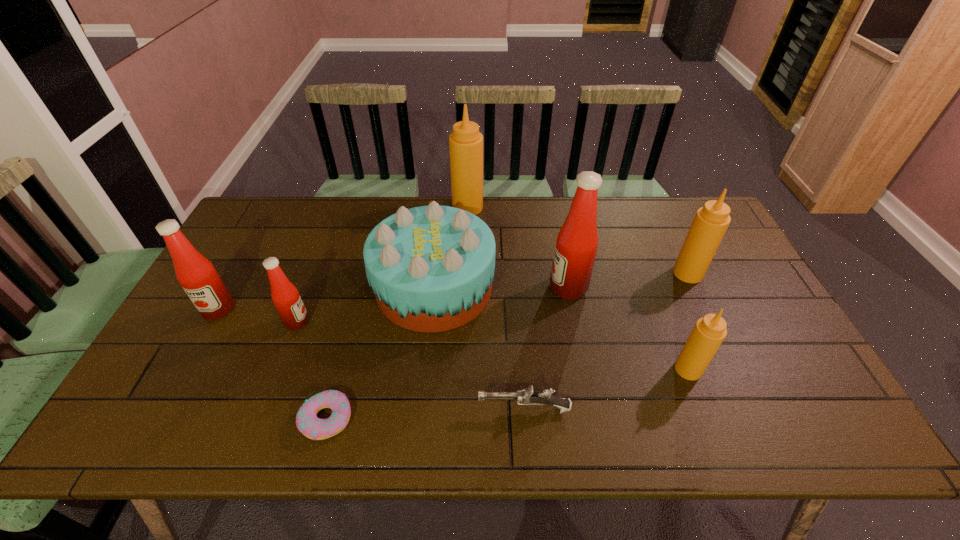
Find the location of a particular element. The width and height of the screenshot is (960, 540). the farthest object is located at coordinates (465, 142).

Where is `the farthest tan condiment`? Image resolution: width=960 pixels, height=540 pixels. the farthest tan condiment is located at coordinates (465, 142).

You are a GUI agent. You are given a task and a screenshot of the screen. Output one action in this format:
    pyautogui.click(x=<x>, y=<y>)
    Task: Click on the fourth condiment from left to right
    
    Given the screenshot: What is the action you would take?
    pyautogui.click(x=576, y=246)

You are a GUI agent. You are given a task and a screenshot of the screen. Output one action in this format:
    pyautogui.click(x=<x>, y=<y>)
    Task: Click on the biggest red condiment
    
    Given the screenshot: What is the action you would take?
    pyautogui.click(x=576, y=246)

Where is `the rightmost tan condiment`? the rightmost tan condiment is located at coordinates (711, 221).

Locate an element on the screen. This screenshot has height=540, width=960. the second smallest tan condiment is located at coordinates (711, 221).

Locate an element on the screen. The image size is (960, 540). the second biggest red condiment is located at coordinates (196, 274).

Find the location of a particular element. The width and height of the screenshot is (960, 540). the leftmost condiment is located at coordinates (196, 274).

Find the location of `cake`. cake is located at coordinates (431, 268).

I want to click on the fifth condiment from left to right, so click(709, 331).